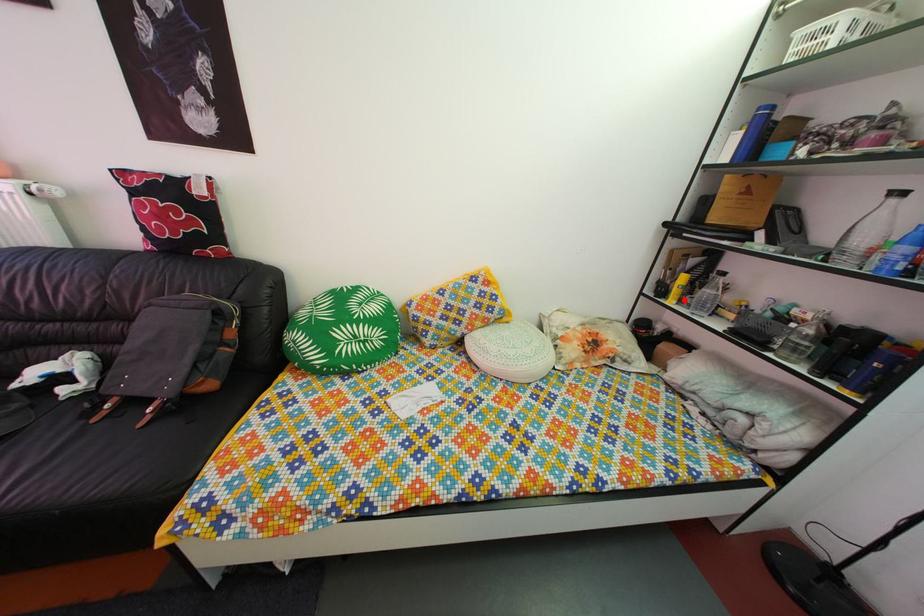
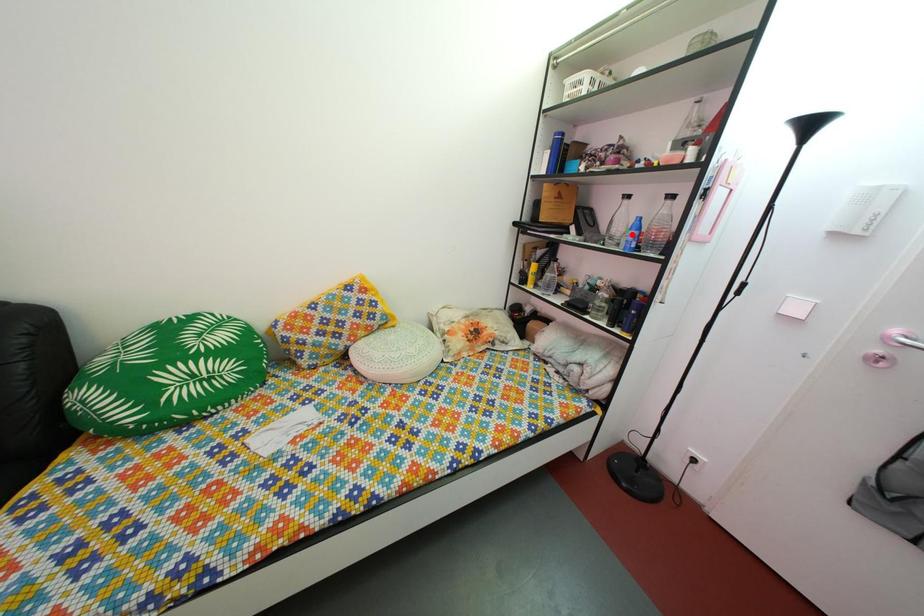
I am providing you with two images of the same scene from different viewpoints. A red point is marked on the first image and another point is marked on the second image. Is the marked point in image1 the same physical position as the marked point in image2?

No